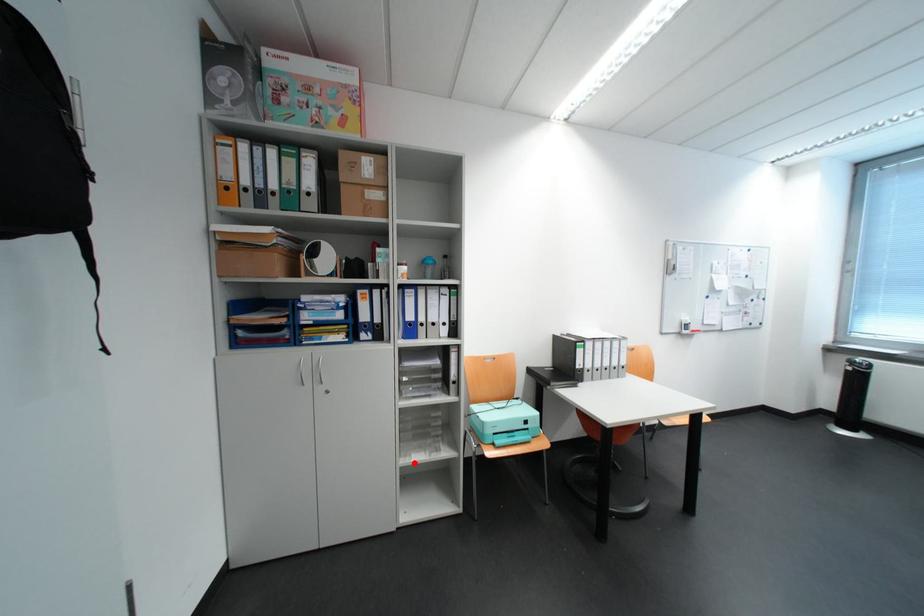
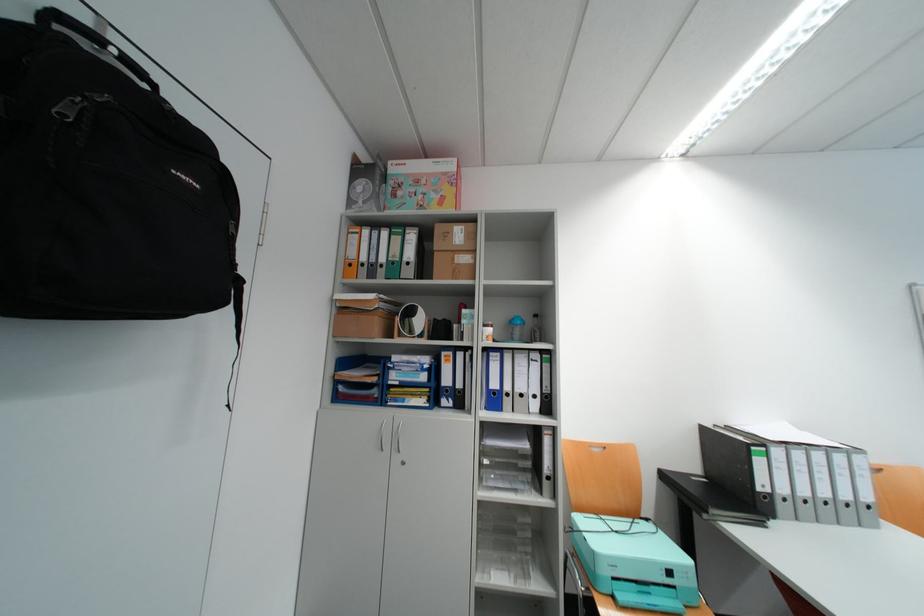
Locate, in the second image, the point that corresponds to the highlighted location in the first image.

(491, 581)